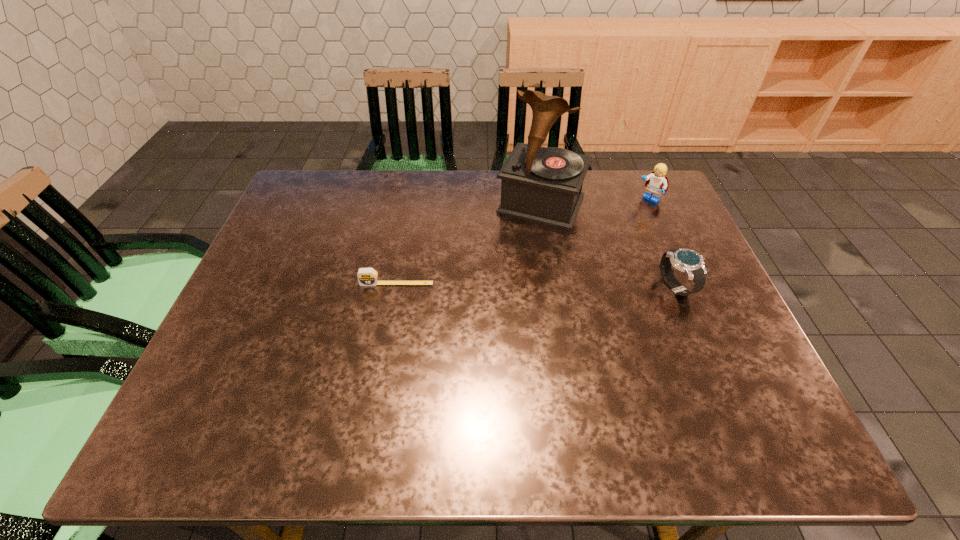
In the image, there is a desktop. Identify the location of vacant space at the left edge. (333, 219).

In the image, there is a desktop. At what (x,y) coordinates should I click in order to perform the action: click on vacant space at the right edge. Please return your answer as a coordinate pair (x, y). The width and height of the screenshot is (960, 540). Looking at the image, I should click on (641, 234).

In the image, there is a desktop. At what (x,y) coordinates should I click in order to perform the action: click on vacant space at the far left corner. Please return your answer as a coordinate pair (x, y). Looking at the image, I should click on (303, 186).

The width and height of the screenshot is (960, 540). In the image, there is a desktop. Identify the location of vacant space at the far right corner. (627, 171).

Where is `free space between the shortest object and the second shortest object`? free space between the shortest object and the second shortest object is located at coordinates (537, 285).

Image resolution: width=960 pixels, height=540 pixels. Find the location of `vacant point located between the third object from right to left and the leftmost object`. vacant point located between the third object from right to left and the leftmost object is located at coordinates click(x=468, y=244).

This screenshot has width=960, height=540. In order to click on free space between the tallest object and the Lego in this screenshot , I will do `click(595, 202)`.

Where is `free spot between the phonograph_record and the Lego`? This screenshot has height=540, width=960. free spot between the phonograph_record and the Lego is located at coordinates (595, 202).

Locate an element on the screen. free area in between the phonograph_record and the Lego is located at coordinates (595, 202).

Locate an element on the screen. The width and height of the screenshot is (960, 540). vacant space that's between the Lego and the tallest object is located at coordinates (595, 202).